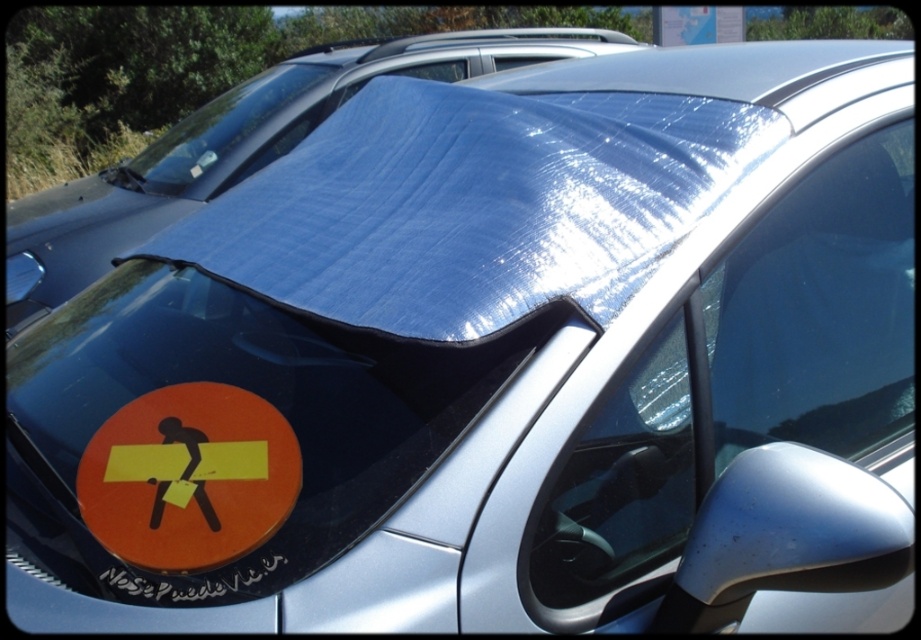
Is transparent plastic windshield at center wider than transparent plastic windshield at upper center?

Incorrect, transparent plastic windshield at center's width does not surpass transparent plastic windshield at upper center's.

Is transparent plastic windshield at center taller than transparent plastic windshield at upper center?

No, transparent plastic windshield at center is not taller than transparent plastic windshield at upper center.

This screenshot has width=921, height=640. What do you see at coordinates (749, 371) in the screenshot? I see `transparent plastic windshield at center` at bounding box center [749, 371].

You are a GUI agent. You are given a task and a screenshot of the screen. Output one action in this format:
    pyautogui.click(x=<x>, y=<y>)
    Task: Click on the transparent plastic windshield at center
    This screenshot has height=640, width=921.
    Given the screenshot: What is the action you would take?
    pyautogui.click(x=749, y=371)

Is transparent plastic windshield at center positioned behind blue reflective tarp at center?

No, it is in front of blue reflective tarp at center.

How far apart are transparent plastic windshield at center and blue reflective tarp at center?

The distance of transparent plastic windshield at center from blue reflective tarp at center is 4.05 meters.

This screenshot has width=921, height=640. I want to click on transparent plastic windshield at center, so click(749, 371).

Who is taller, blue reflective tarp at center or orange matte sticker at lower left?

Standing taller between the two is blue reflective tarp at center.

Does blue reflective tarp at center appear on the left side of orange matte sticker at lower left?

Yes, blue reflective tarp at center is to the left of orange matte sticker at lower left.

Is point (533, 28) farther from viewer compared to point (271, 476)?

Yes, it is behind point (271, 476).

The image size is (921, 640). Identify the location of blue reflective tarp at center. (240, 148).